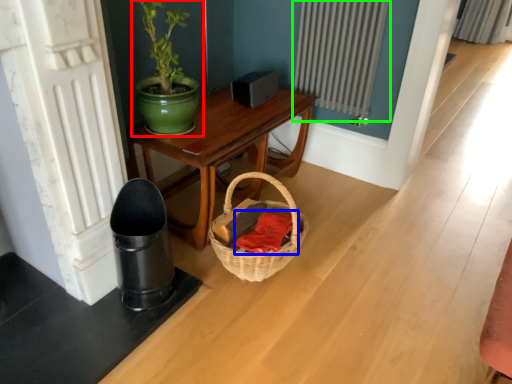
Question: Which object is positioned closest to houseplant (highlighted by a red box)? Select from clothing (highlighted by a blue box) and radiator (highlighted by a green box).

Choices:
 (A) clothing
 (B) radiator

Answer: (A)